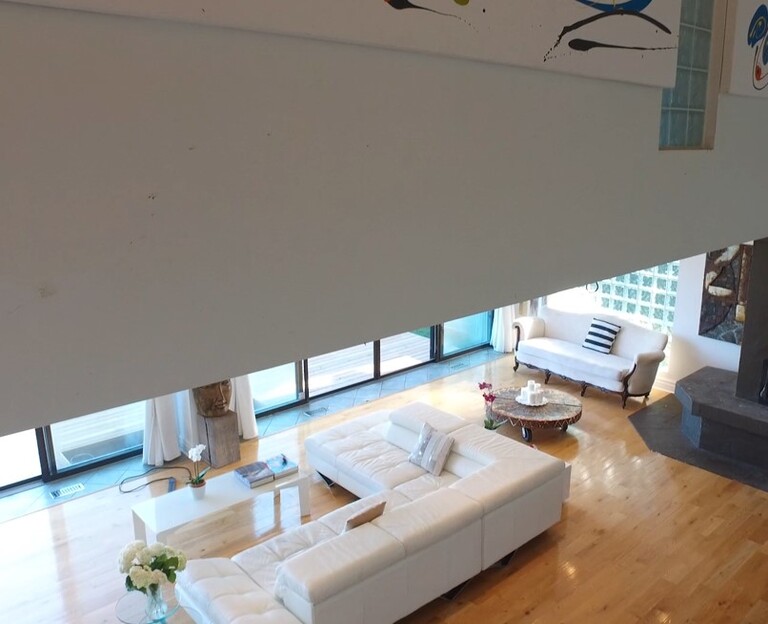
Where is `artwork`? This screenshot has height=624, width=768. artwork is located at coordinates (604, 55).